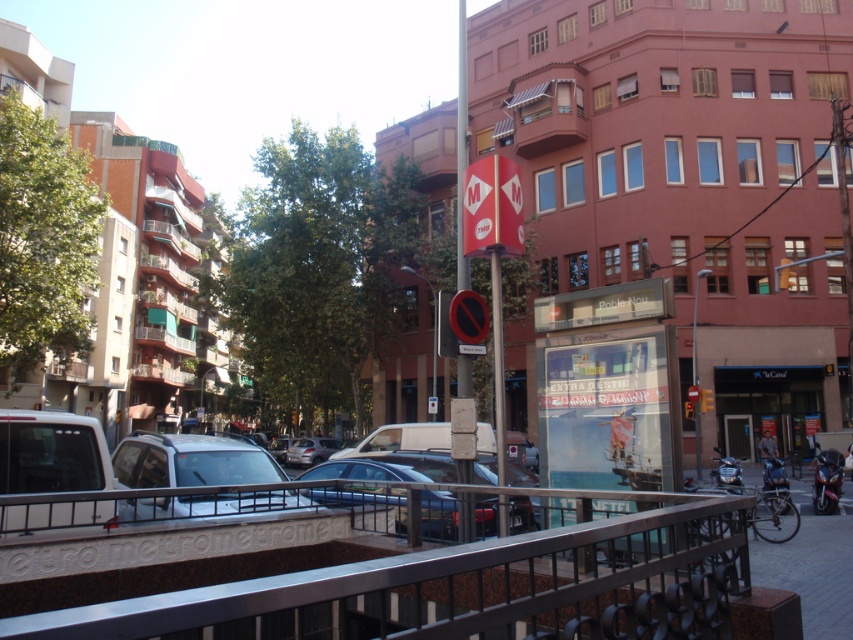
You are a pedestrian standing at the intersection and want to cross the street. You see the polished metal rail at center and the red glass traffic light at upper right. Which object is positioned higher from the ground?

The red glass traffic light at upper right is positioned higher from the ground than the polished metal rail at center.

You are a delivery person who needs to place a package on the ground between the polished metal rail at center and the red glass traffic light at upper right. The package requires a space of 70 feet. Is there enough space between them to place the package?

The distance between the polished metal rail at center and the red glass traffic light at upper right is 76.74 feet, which is more than the required 70 feet. Therefore, there is enough space to place the package between them.